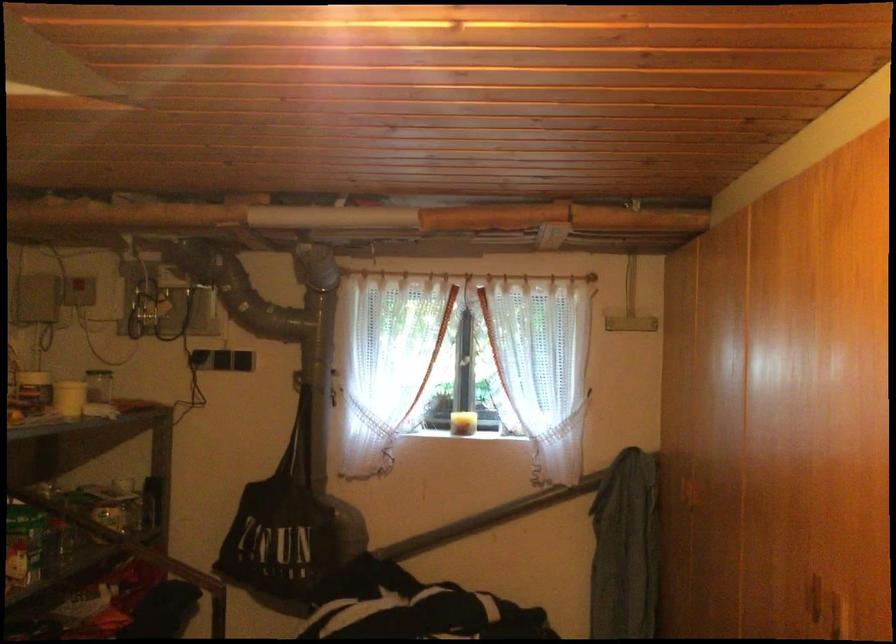
Question: How did the camera likely rotate?

Choices:
 (A) Left
 (B) Right
 (C) Up
 (D) Down

Answer: (B)